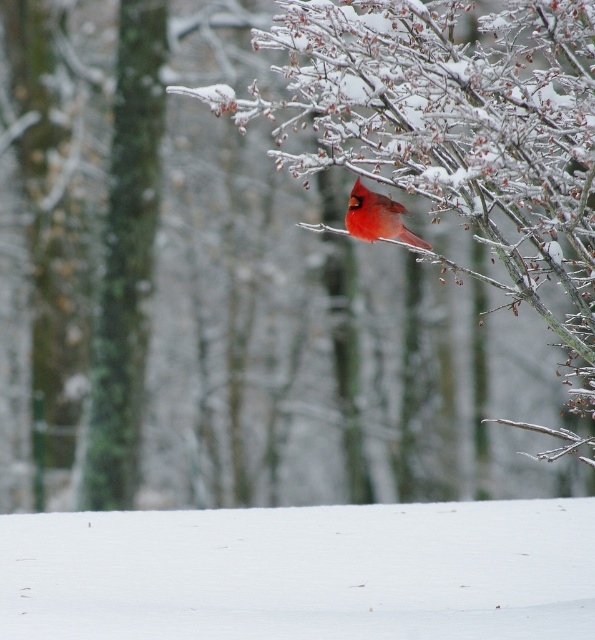
Question: In this image, where is green mossy tree trunk at left located relative to matte red cardinal at upper center?

Choices:
 (A) below
 (B) above

Answer: (B)

Question: Which of the following is the farthest from the observer?

Choices:
 (A) (126, 74)
 (B) (142, 618)
 (C) (386, 216)

Answer: (A)

Question: Is white fluffy snow at lower center positioned behind matte red cardinal at upper center?

Choices:
 (A) no
 (B) yes

Answer: (A)

Question: Is white fluffy snow at lower center to the left of green mossy tree trunk at left from the viewer's perspective?

Choices:
 (A) yes
 (B) no

Answer: (B)

Question: Which of the following is the farthest from the observer?

Choices:
 (A) matte red cardinal at upper center
 (B) green mossy tree trunk at left

Answer: (B)

Question: Which object appears farthest from the camera in this image?

Choices:
 (A) green mossy tree trunk at left
 (B) white fluffy snow at lower center
 (C) matte red cardinal at upper center

Answer: (A)